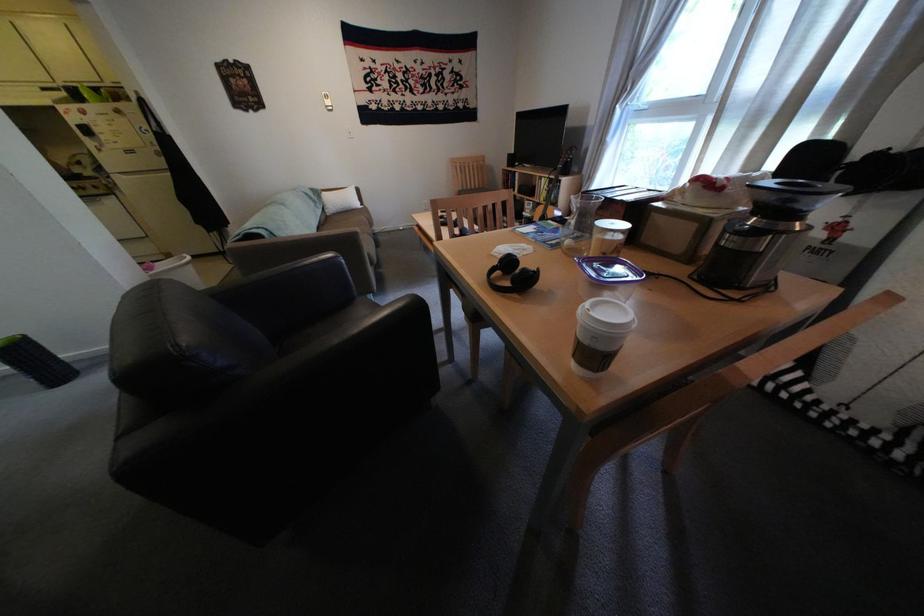
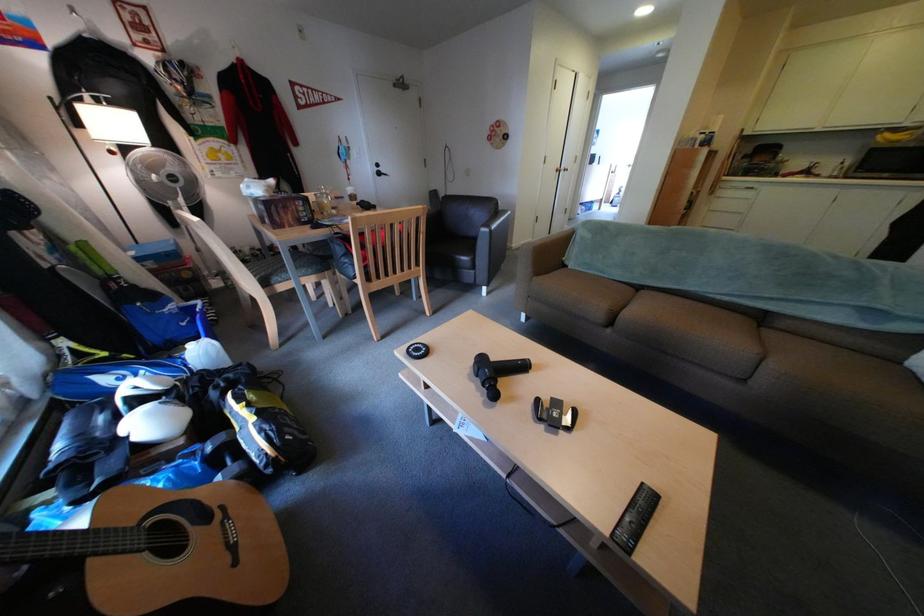
In the second image, find the point that corresponds to (561,214) in the first image.

(148, 527)